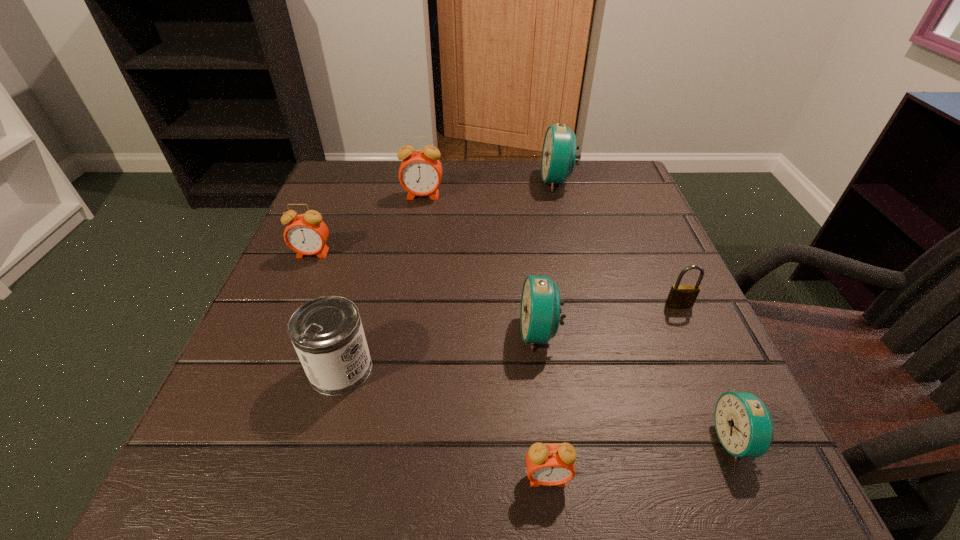
This screenshot has height=540, width=960. Identify the location of object located at the far right corner. (559, 156).

Image resolution: width=960 pixels, height=540 pixels. Identify the location of object that is at the near right corner. (744, 426).

You are a GUI agent. You are given a task and a screenshot of the screen. Output one action in this format:
    pyautogui.click(x=<x>, y=<y>)
    Task: Click on the vacant space at the far edge of the desktop
    The height and width of the screenshot is (540, 960).
    Given the screenshot: What is the action you would take?
    pyautogui.click(x=462, y=188)

This screenshot has height=540, width=960. I want to click on free region at the near edge of the desktop, so click(466, 498).

In the image, there is a desktop. At what (x,y) coordinates should I click in order to perform the action: click on vacant space at the left edge. Please return your answer as a coordinate pair (x, y). Looking at the image, I should click on (363, 268).

At what (x,y) coordinates should I click in order to perform the action: click on vacant area at the right edge. Please return your answer as a coordinate pair (x, y). Looking at the image, I should click on coord(626,215).

This screenshot has height=540, width=960. I want to click on blank space at the far left corner, so click(366, 164).

In the image, there is a desktop. Where is `free space at the far right corner`? This screenshot has height=540, width=960. free space at the far right corner is located at coordinates (602, 177).

This screenshot has width=960, height=540. I want to click on free area in between the sixth nearest object and the biggest pink alarm clock, so point(368,225).

Find the location of `vacant area between the can and the second pink alarm clock from left to right`. vacant area between the can and the second pink alarm clock from left to right is located at coordinates [x=382, y=282].